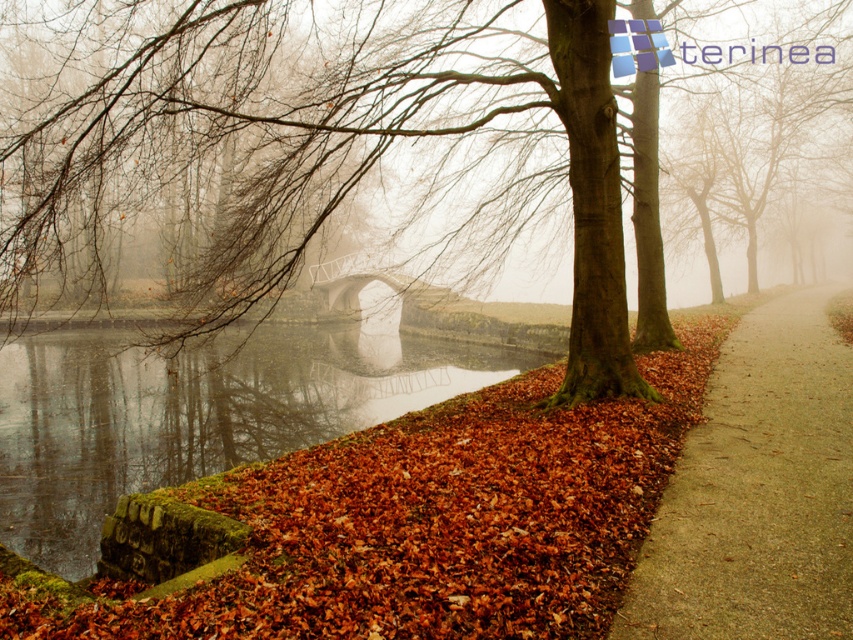
Looking at this image, you are a painter standing on the path and want to paint the brown rough bark tree at center and the brown leafy river at lower left. Which object should you focus on first if you want to paint the wider one?

The brown rough bark tree at center might be wider than brown leafy river at lower left, so you should focus on the brown rough bark tree at center first.

Looking at this image, you are standing at the start of the brown gravel path at lower right and want to cross the metallic gray bridge at center. Which direction should you walk to reach the bridge?

You should walk upwards along the brown gravel path at lower right to reach the metallic gray bridge at center since the path is below the bridge.